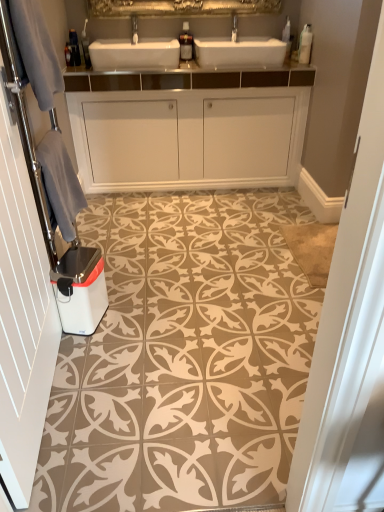
Question: Is white glossy dishwasher at lower left spatially inside white textured towel at left, or outside of it?

Choices:
 (A) inside
 (B) outside

Answer: (B)

Question: Visually, is white glossy dishwasher at lower left positioned to the left or to the right of white textured towel at left?

Choices:
 (A) right
 (B) left

Answer: (A)

Question: Which object is positioned farthest from the brushed metal faucet at upper center?

Choices:
 (A) brown textured tile at center
 (B) white glossy dishwasher at lower left
 (C) white textured towel at left
 (D) gray fabric at left
 (E) white glossy cabinet at center

Answer: (C)

Question: Which of these objects is positioned farthest from the brown textured tile at center?

Choices:
 (A) white textured towel at left
 (B) white glossy dishwasher at lower left
 (C) gray fabric at left
 (D) gray fabric towel at left
 (E) brushed metal faucet at upper center

Answer: (E)